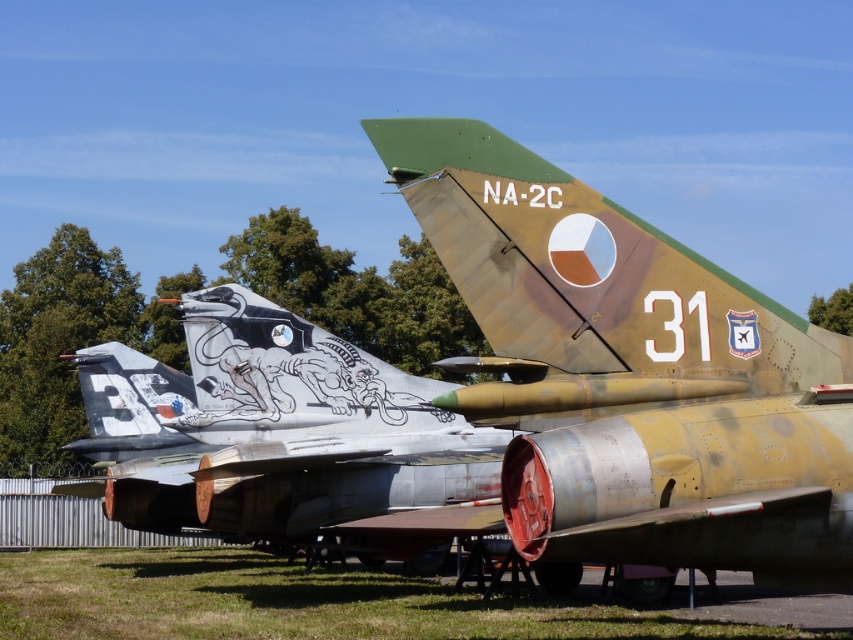
Who is taller, silver metallic aircraft at center or camouflage paint tail at center?

silver metallic aircraft at center

This screenshot has height=640, width=853. In order to click on silver metallic aircraft at center in this screenshot , I will do `click(271, 428)`.

Is the position of camouflage paint airplane at center more distant than that of silver metallic aircraft at center?

No, it is in front of silver metallic aircraft at center.

Is camouflage paint airplane at center wider than silver metallic aircraft at center?

No, camouflage paint airplane at center is not wider than silver metallic aircraft at center.

Which is behind, point (498, 326) or point (277, 333)?

Point (277, 333)

Locate an element on the screen. The width and height of the screenshot is (853, 640). camouflage paint airplane at center is located at coordinates (630, 374).

Which is below, camouflage paint airplane at center or green grass at lower center?

Positioned lower is green grass at lower center.

Is camouflage paint airplane at center positioned before green grass at lower center?

Yes, it is in front of green grass at lower center.

Who is more distant from viewer, (596, 339) or (251, 632)?

The point (251, 632) is behind.

Where is `camouflage paint airplane at center`? camouflage paint airplane at center is located at coordinates (630, 374).